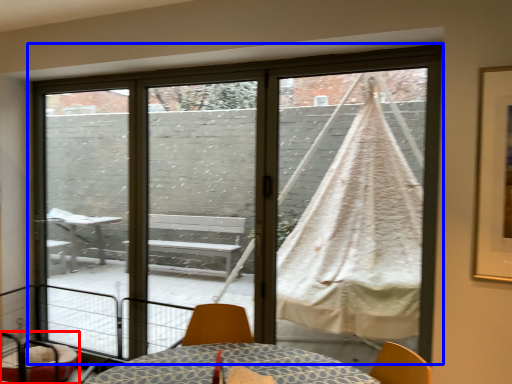
Question: Which object is further to the camera taking this photo, furniture (highlighted by a red box) or window (highlighted by a blue box)?

Choices:
 (A) furniture
 (B) window

Answer: (A)